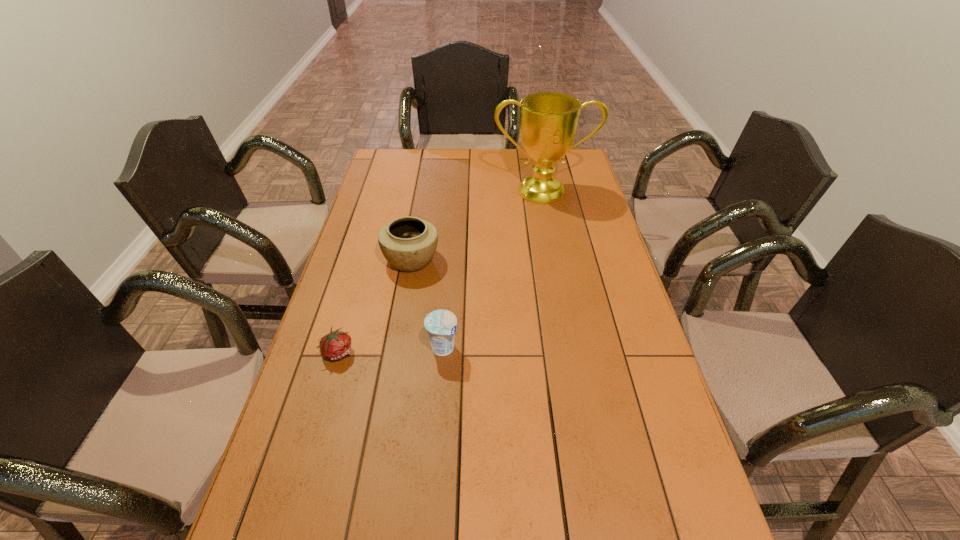
This screenshot has width=960, height=540. I want to click on award, so click(x=548, y=121).

Where is `the tallest object`? This screenshot has width=960, height=540. the tallest object is located at coordinates (548, 121).

Identify the location of pottery. This screenshot has height=540, width=960. (408, 243).

The image size is (960, 540). I want to click on the third shortest object, so click(408, 243).

Find the location of a particular element. The image size is (960, 540). the third tallest object is located at coordinates (441, 325).

At what (x,y) coordinates should I click in order to perform the action: click on the shortest object. Please return your answer as a coordinate pair (x, y). Looking at the image, I should click on (336, 345).

The width and height of the screenshot is (960, 540). What are the coordinates of `the leftmost object` in the screenshot? It's located at (336, 345).

Where is `vacant space situated on the shiny surface of the rightmost object`? This screenshot has height=540, width=960. vacant space situated on the shiny surface of the rightmost object is located at coordinates (560, 278).

Locate an element on the screen. blank space located on the front of the second tallest object is located at coordinates (392, 373).

This screenshot has width=960, height=540. Identify the location of free location located on the left of the yogurt. (323, 348).